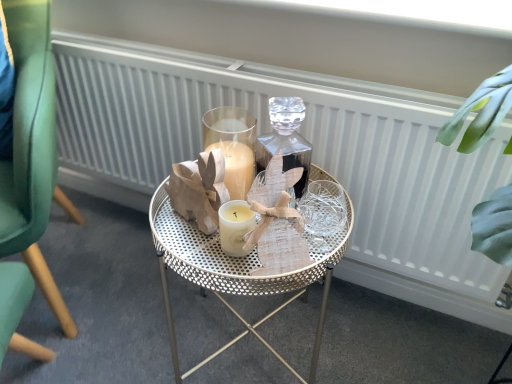
Locate an element on the screen. free area below metallic gold table at center (from a real-world perspective) is located at coordinates (248, 338).